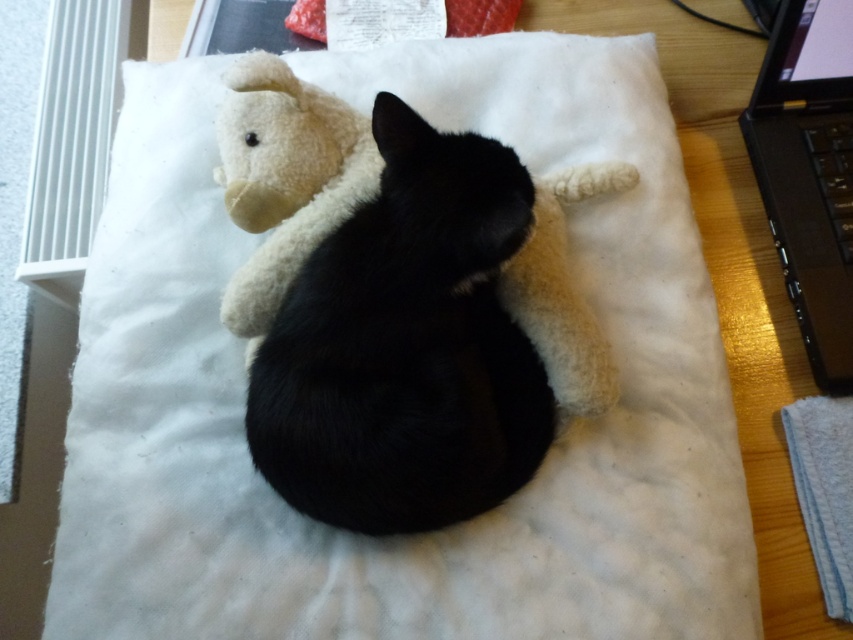
Can you confirm if black fur cat at center is wider than black plastic laptop at right?

Yes, black fur cat at center is wider than black plastic laptop at right.

Is black fur cat at center positioned behind black plastic laptop at right?

That is False.

Identify the location of black fur cat at center. (405, 346).